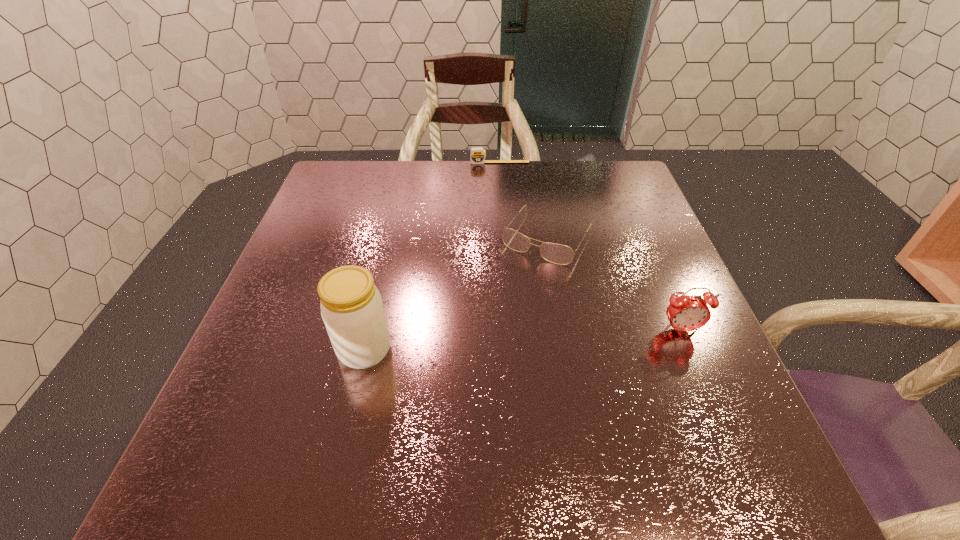
You are a GUI agent. You are given a task and a screenshot of the screen. Output one action in this format:
    pyautogui.click(x=<x>, y=<y>)
    Task: Click on the empty space between the rightmost object and the second farthest object
    The width and height of the screenshot is (960, 540).
    Given the screenshot: What is the action you would take?
    pyautogui.click(x=614, y=283)

The image size is (960, 540). I want to click on vacant point located between the spectacles and the rightmost object, so 614,283.

This screenshot has width=960, height=540. Find the location of `vacant area between the rightmost object and the farthest object`. vacant area between the rightmost object and the farthest object is located at coordinates (590, 246).

You are a GUI agent. You are given a task and a screenshot of the screen. Output one action in this format:
    pyautogui.click(x=<x>, y=<y>)
    Task: Click on the closest object to the farthest object
    The height and width of the screenshot is (540, 960).
    Given the screenshot: What is the action you would take?
    pyautogui.click(x=559, y=254)

Identify which object is the nearest to the shortest object. Please provide its 2D coordinates. Your answer should be formatted as a tuple, i.e. [(x, y)], where the tuple contains the x and y coordinates of a point satisfying the conditions above.

[(559, 254)]